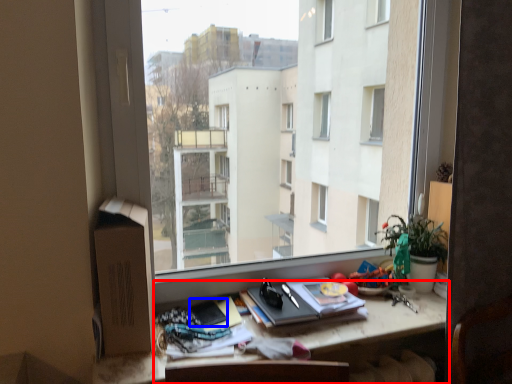
Question: Which object is further to the camera taking this photo, desk (highlighted by a red box) or paperback book (highlighted by a blue box)?

Choices:
 (A) desk
 (B) paperback book

Answer: (B)